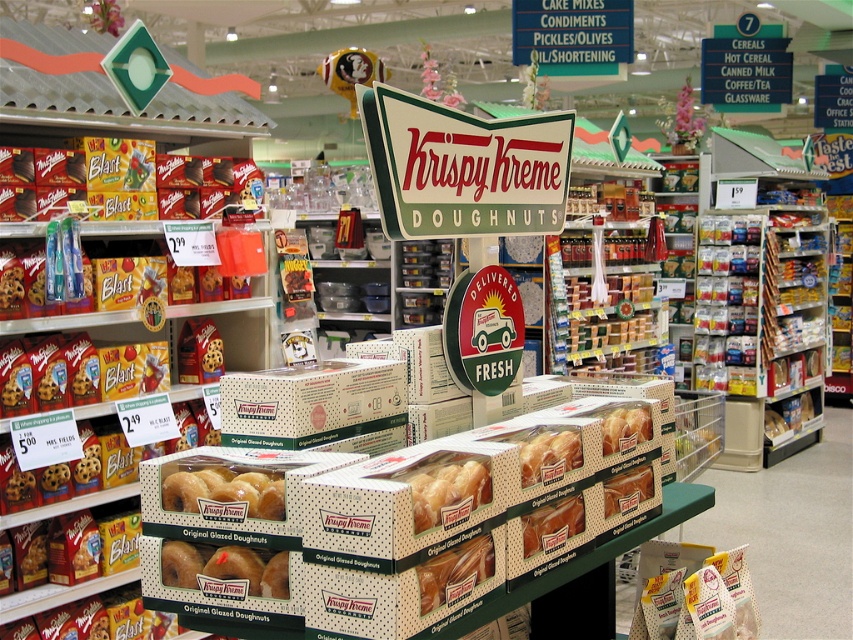
Is golden glazed doughnut at center wider than matte glazed donut at center?

Indeed, golden glazed doughnut at center has a greater width compared to matte glazed donut at center.

Is point (161, 563) closer to camera compared to point (193, 509)?

No, (161, 563) is behind (193, 509).

Where is `golden glazed doughnut at center`? Image resolution: width=853 pixels, height=640 pixels. golden glazed doughnut at center is located at coordinates (225, 566).

Locate an element on the screen. golden glazed doughnut at center is located at coordinates (225, 566).

How distant is white dotted cardboard box at center from matte glazed donut at center?

white dotted cardboard box at center is 9.10 inches away from matte glazed donut at center.

Does white dotted cardboard box at center appear on the right side of matte glazed donut at center?

Correct, you'll find white dotted cardboard box at center to the right of matte glazed donut at center.

Is point (312, 410) farther from camera compared to point (180, 509)?

Yes, point (312, 410) is behind point (180, 509).

Locate an element on the screen. white dotted cardboard box at center is located at coordinates (311, 403).

Can you confirm if white dotted cardboard box at center is shorter than golden glazed doughnut at center?

No, white dotted cardboard box at center is not shorter than golden glazed doughnut at center.

At what (x,y) coordinates should I click in order to perform the action: click on white dotted cardboard box at center. Please return your answer as a coordinate pair (x, y). The image size is (853, 640). Looking at the image, I should click on (311, 403).

You are a GUI agent. You are given a task and a screenshot of the screen. Output one action in this format:
    pyautogui.click(x=<x>, y=<y>)
    Task: Click on the white dotted cardboard box at center
    The width and height of the screenshot is (853, 640).
    Given the screenshot: What is the action you would take?
    pyautogui.click(x=311, y=403)